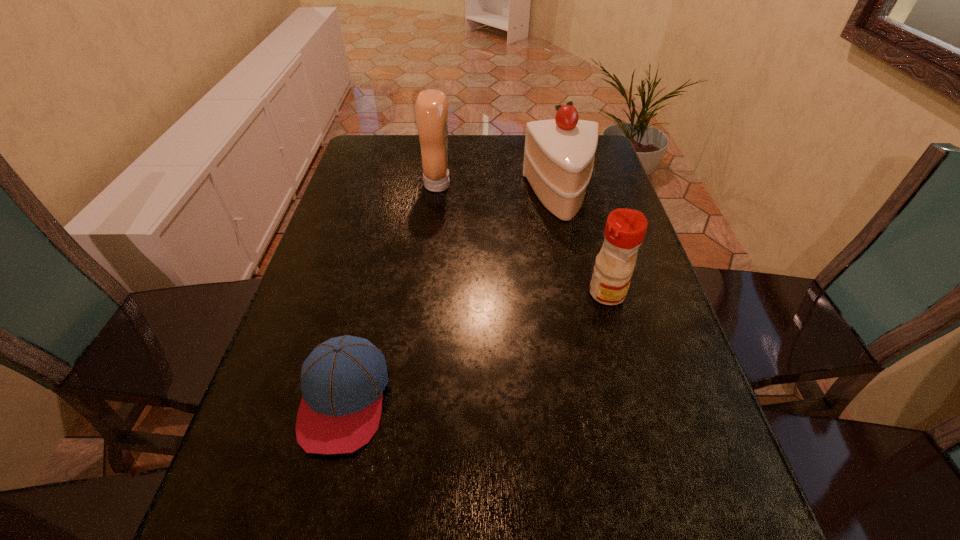
Where is `free region located on the front-facing side of the leftmost object`? The image size is (960, 540). free region located on the front-facing side of the leftmost object is located at coordinates (323, 489).

The width and height of the screenshot is (960, 540). Find the location of `object located at the far edge`. object located at the far edge is located at coordinates (431, 108).

At what (x,y) coordinates should I click in order to perform the action: click on object that is positioned at the left edge. Please return your answer as a coordinate pair (x, y). Looking at the image, I should click on (342, 381).

Image resolution: width=960 pixels, height=540 pixels. Find the location of `cake at the right edge`. cake at the right edge is located at coordinates (559, 153).

This screenshot has width=960, height=540. I want to click on condiment that is at the right edge, so click(625, 229).

This screenshot has height=540, width=960. What are the coordinates of `vacant space at the far edge of the desktop` in the screenshot? It's located at (508, 139).

Identify the location of vacant space at the left edge of the desktop. (360, 184).

Where is `vacant space at the right edge of the desktop`? vacant space at the right edge of the desktop is located at coordinates (642, 288).

You are a GUI agent. You are given a task and a screenshot of the screen. Output one action in this format:
    pyautogui.click(x=<x>, y=<y>)
    Task: Click on the blank space at the far left corner
    The height and width of the screenshot is (540, 960).
    Given the screenshot: What is the action you would take?
    pyautogui.click(x=399, y=140)

Where is `vacant space in between the cake and the third farthest object`? vacant space in between the cake and the third farthest object is located at coordinates (584, 245).